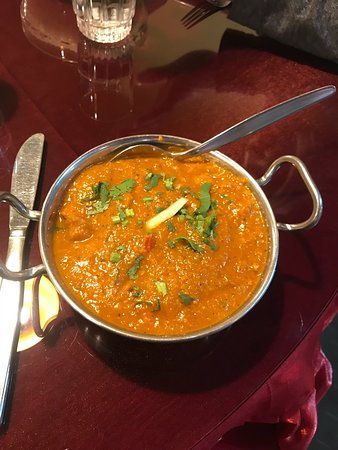
You are a GUI agent. You are given a task and a screenshot of the screen. Output one action in this format:
    pyautogui.click(x=<x>, y=<y>)
    Task: Click on the rim of bowl
    
    Given the screenshot: What is the action you would take?
    pyautogui.click(x=139, y=136), pyautogui.click(x=154, y=338), pyautogui.click(x=271, y=210), pyautogui.click(x=40, y=237)